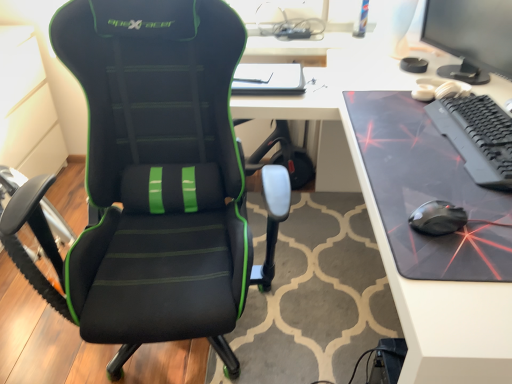
Question: Considering their positions, is matte black monitor at upper right located in front of or behind black matte keyboard at right?

Choices:
 (A) front
 (B) behind

Answer: (B)

Question: Looking at the image, does matte black monitor at upper right seem bigger or smaller compared to black matte keyboard at right?

Choices:
 (A) big
 (B) small

Answer: (A)

Question: Estimate the real-world distances between objects in this image. Which object is farther from the black leather chair at left?

Choices:
 (A) black matte keyboard at right
 (B) matte black monitor at upper right
 (C) black glossy mouse at right
 (D) transparent plastic mousepad at right

Answer: (B)

Question: Based on their relative distances, which object is nearer to the black glossy mouse at right?

Choices:
 (A) black matte keyboard at right
 (B) transparent plastic mousepad at right
 (C) black leather chair at left
 (D) matte black monitor at upper right

Answer: (A)